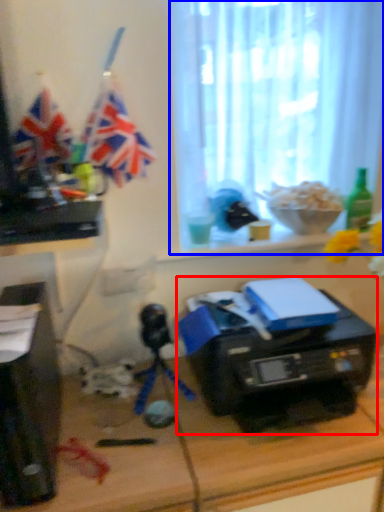
Question: Which of the following is the farthest to the observer, printer (highlighted by a red box) or window screen (highlighted by a blue box)?

Choices:
 (A) printer
 (B) window screen

Answer: (B)